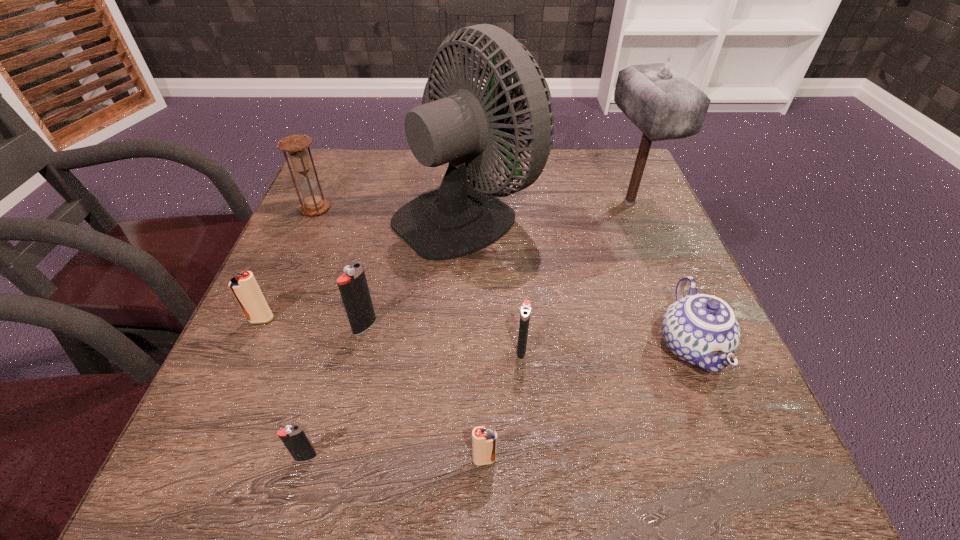
This screenshot has width=960, height=540. I want to click on vacant area that lies between the smallest black igniter and the mallet, so click(x=468, y=330).

Identify the location of free space between the mallet and the farther red igniter. This screenshot has height=540, width=960. (445, 261).

Identify the location of vacant area between the seventh object from right to left and the chinaware. This screenshot has width=960, height=540. (498, 402).

Identify the location of free space between the third tallest object and the bigger red igniter. The height and width of the screenshot is (540, 960). (289, 264).

Locate an element on the screen. This screenshot has height=540, width=960. vacant region between the second black igniter from left to right and the nearest black igniter is located at coordinates (335, 392).

Locate an element on the screen. The height and width of the screenshot is (540, 960). empty location between the fan and the chinaware is located at coordinates (579, 279).

I want to click on vacant space that's between the second farthest black igniter and the gray fan, so click(x=494, y=281).

Locate an element on the screen. The width and height of the screenshot is (960, 540). free spot between the smaller red igniter and the mallet is located at coordinates (557, 332).

The height and width of the screenshot is (540, 960). What are the coordinates of `the third closest object to the second smallest black igniter` in the screenshot? It's located at (702, 330).

What are the coordinates of `object that is the fifth closest to the chinaware` in the screenshot? It's located at (353, 287).